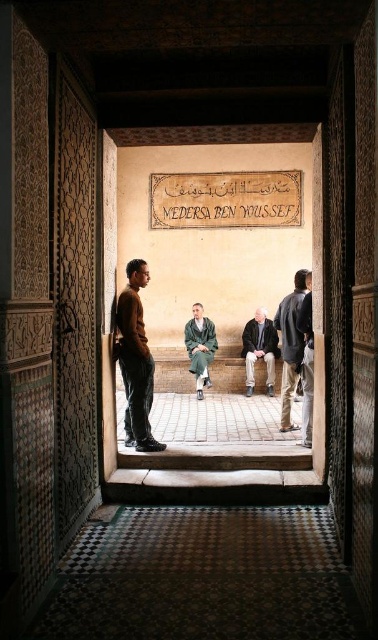
Question: Among these objects, which one is farthest from the camera?

Choices:
 (A) carved wood door at left
 (B) green woolen robe at center

Answer: (B)

Question: Can you confirm if carved wood door at left is thinner than green woolen robe at center?

Choices:
 (A) yes
 (B) no

Answer: (A)

Question: Among these objects, which one is nearest to the camera?

Choices:
 (A) carved wood door at left
 (B) dark gray fabric jacket at right
 (C) brown wool sweater at left
 (D) green woolen robe at center

Answer: (A)

Question: Which point is closer to the camera?

Choices:
 (A) (297, 332)
 (B) (302, 416)

Answer: (B)

Question: Is carved wood door at left smaller than dark blue fabric jacket at right?

Choices:
 (A) no
 (B) yes

Answer: (B)

Question: Does carved wood door at left lie behind brown wool sweater at left?

Choices:
 (A) no
 (B) yes

Answer: (A)